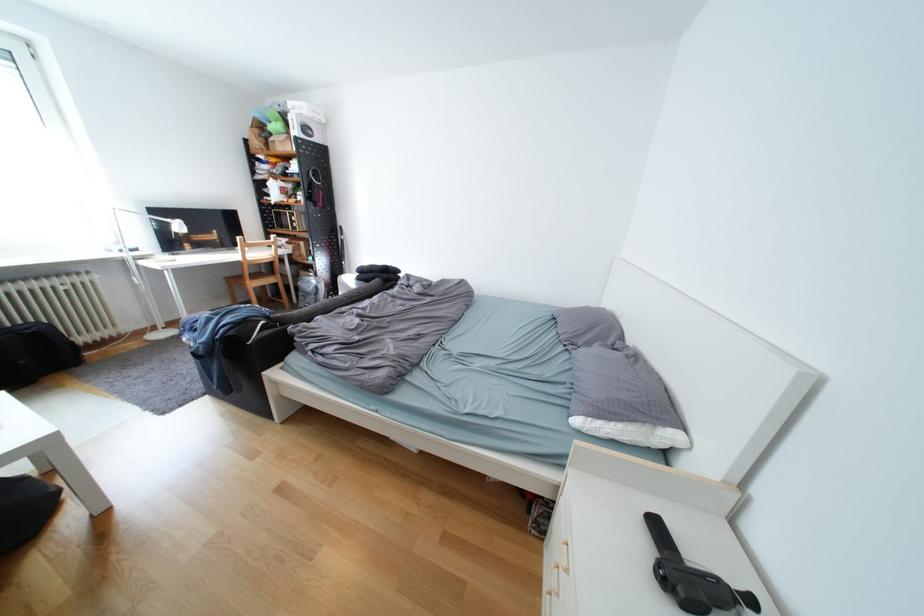
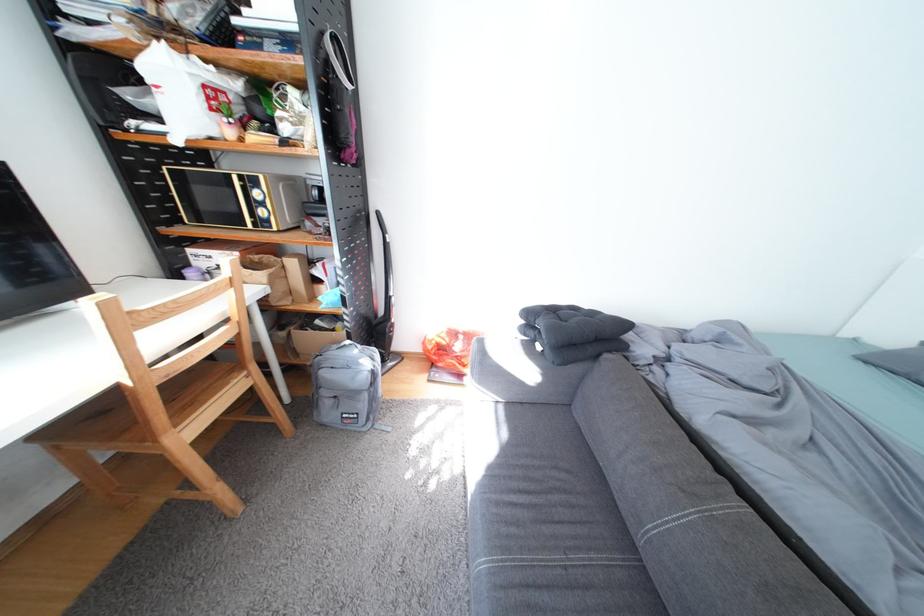
Find the pixel in the second image that matches pixel 325 297 in the first image.

(378, 397)